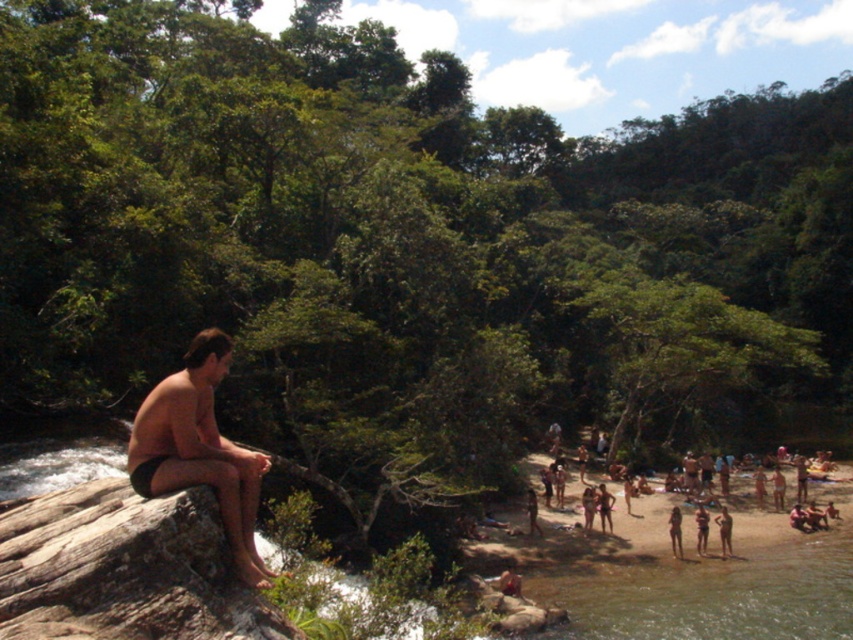
Measure the distance between matte black shorts at left and camera.

A distance of 19.37 feet exists between matte black shorts at left and camera.

Between matte black shorts at left and tan skin human at lower right, which one is positioned lower?

tan skin human at lower right is lower down.

Does point (193, 424) come closer to viewer compared to point (677, 538)?

Yes, point (193, 424) is closer to viewer.

The image size is (853, 640). I want to click on matte black shorts at left, so click(x=199, y=449).